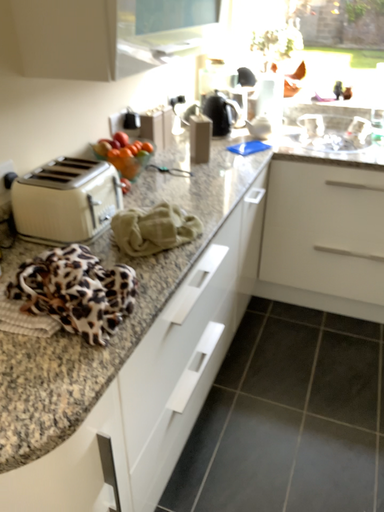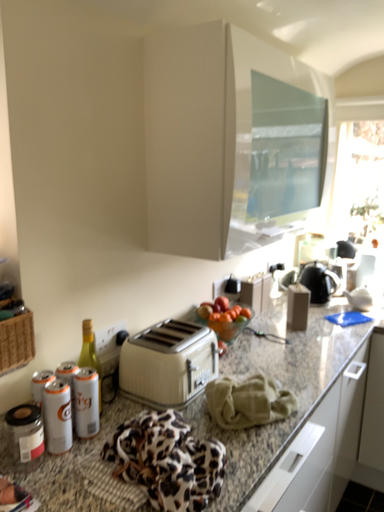
Question: How did the camera likely rotate when shooting the video?

Choices:
 (A) rotated upward
 (B) rotated downward

Answer: (A)